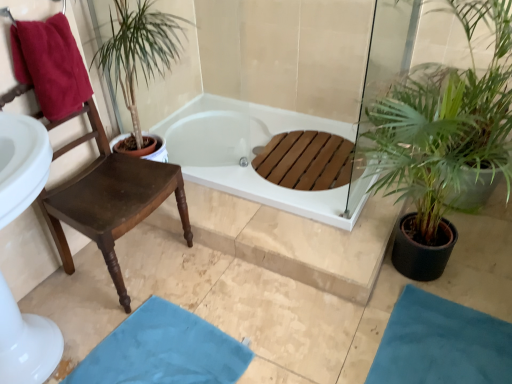
I want to click on free point above blue fabric bath mat at lower center, placed as the first bath mat when sorted from left to right (from a real-world perspective), so click(x=164, y=354).